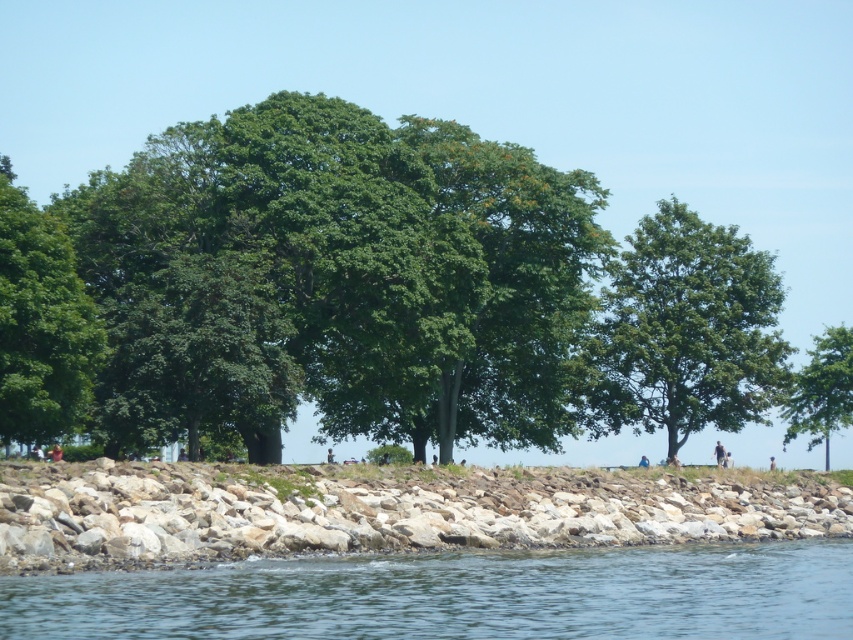
Question: Is clear blue water at lower left smaller than green leafy tree at left?

Choices:
 (A) no
 (B) yes

Answer: (B)

Question: Which object is closer to the camera taking this photo?

Choices:
 (A) light blue jeans at center
 (B) green leafy tree at center

Answer: (A)

Question: Which of the following is the closest to the observer?

Choices:
 (A) green leafy tree at center
 (B) clear blue water at lower left
 (C) green leafy tree at right

Answer: (B)

Question: Is the position of green leafy tree at left more distant than that of green leafy tree at right?

Choices:
 (A) no
 (B) yes

Answer: (A)

Question: Can you confirm if green leafy tree at right is thinner than light blue jeans at center?

Choices:
 (A) yes
 (B) no

Answer: (B)

Question: Among these objects, which one is nearest to the camera?

Choices:
 (A) light blue jeans at center
 (B) green leafy tree at left

Answer: (B)